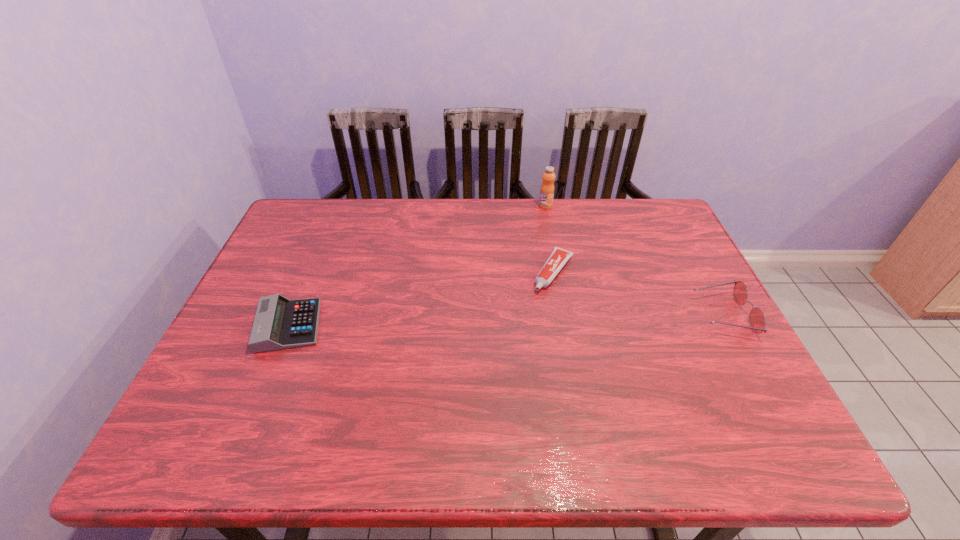
This screenshot has height=540, width=960. Identify the location of the leftmost object. (279, 323).

Image resolution: width=960 pixels, height=540 pixels. What are the coordinates of `the second tallest object` in the screenshot? It's located at 757,320.

At what (x,y) coordinates should I click in order to perform the action: click on the rightmost object. Please return your answer as a coordinate pair (x, y). The height and width of the screenshot is (540, 960). Looking at the image, I should click on (757, 320).

Locate an element on the screen. The image size is (960, 540). toothpaste is located at coordinates (558, 258).

This screenshot has height=540, width=960. I want to click on orange juice, so click(x=547, y=188).

The image size is (960, 540). What are the coordinates of `the tallest object` in the screenshot? It's located at (547, 188).

Where is `free spot located on the right of the leftmost object`? free spot located on the right of the leftmost object is located at coordinates (343, 326).

You are a GUI agent. You are given a task and a screenshot of the screen. Output one action in this format:
    pyautogui.click(x=<x>, y=<y>)
    Task: Click on the free region located 0.150m on the front-facing side of the spectacles
    This screenshot has height=540, width=960.
    Given the screenshot: What is the action you would take?
    pyautogui.click(x=640, y=315)

You are a GUI agent. You are given a task and a screenshot of the screen. Output one action in this format:
    pyautogui.click(x=<x>, y=<y>)
    Task: Click on the vacant space situated 0.190m on the front-facing side of the spectacles
    The image size is (960, 540).
    Given the screenshot: What is the action you would take?
    pyautogui.click(x=625, y=315)

Locate an element on the screen. This screenshot has width=960, height=540. vacant space situated 0.300m on the front-facing side of the spectacles is located at coordinates (583, 315).